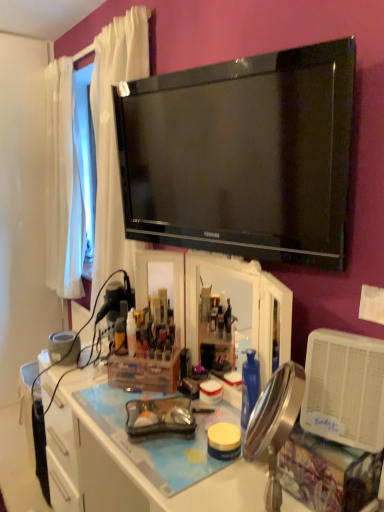
The height and width of the screenshot is (512, 384). I want to click on free space above clear plastic desk at center (from a real-world perspective), so click(176, 428).